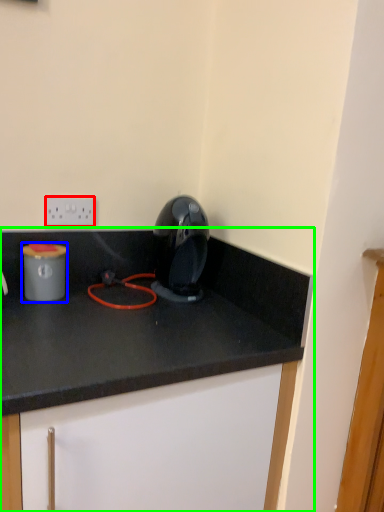
Question: Which object is the closest to the electric outlet (highlighted by a red box)? Choose among these: appliance (highlighted by a blue box) or cabinetry (highlighted by a green box).

Choices:
 (A) appliance
 (B) cabinetry

Answer: (A)